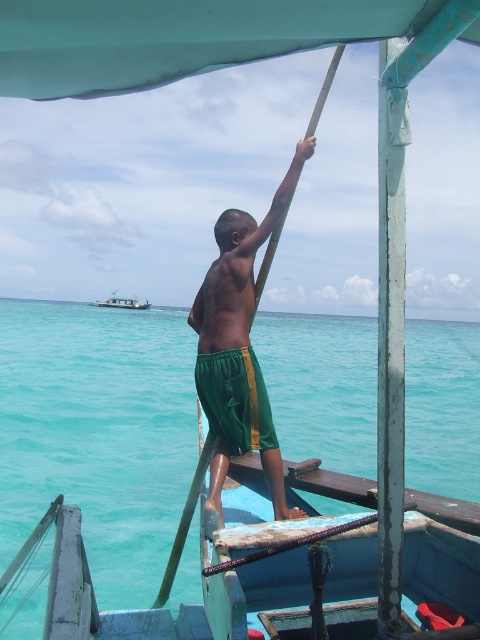
You are a safety inspector on the boat and need to ensure the teal painted wood pole at right and the green fabric shorts at center are properly secured. Which object requires more attention due to its size?

The teal painted wood pole at right requires more attention because it has a larger size compared to the green fabric shorts at center, making it potentially more unstable if not secured properly.

You are a safety inspector on the boat. You notice the boy standing near the edge. Based on the position of the turquoise water at center and the green fabric shorts at center, is there a risk of the boy falling into the water?

The turquoise water at center is below green fabric shorts at center, which means the boy is standing near the edge of the boat where the water is directly underneath. This creates a risk of the boy falling into the water.